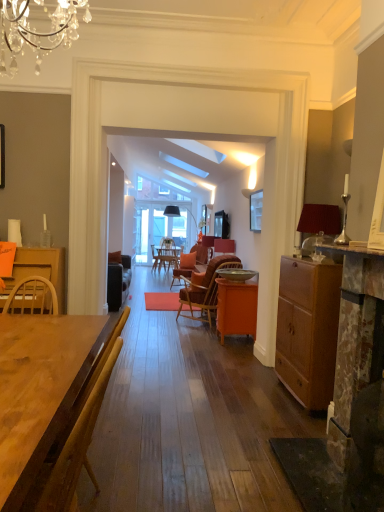
Question: From a real-world perspective, does matte brown cabinet at right stand above orange matte cabinet at center, which ranks as the 2th desk in front-to-back order?

Choices:
 (A) yes
 (B) no

Answer: (A)

Question: Is matte brown cabinet at right to the left of orange matte cabinet at center, which ranks as the 2th desk in front-to-back order, from the viewer's perspective?

Choices:
 (A) yes
 (B) no

Answer: (B)

Question: Considering the relative sizes of matte brown cabinet at right and orange matte cabinet at center, positioned as the 1th desk in right-to-left order, in the image provided, is matte brown cabinet at right thinner than orange matte cabinet at center, positioned as the 1th desk in right-to-left order,?

Choices:
 (A) no
 (B) yes

Answer: (B)

Question: Is matte brown cabinet at right further to camera compared to orange matte cabinet at center, which ranks as the 2th desk in front-to-back order?

Choices:
 (A) no
 (B) yes

Answer: (A)

Question: From a real-world perspective, is matte brown cabinet at right positioned under orange matte cabinet at center, which appears as the first desk when viewed from the back, based on gravity?

Choices:
 (A) yes
 (B) no

Answer: (B)

Question: Can you confirm if matte brown cabinet at right is shorter than orange matte cabinet at center, which appears as the first desk when viewed from the back?

Choices:
 (A) no
 (B) yes

Answer: (A)

Question: Is matte brown cabinet at right oriented towards wooden table at center, positioned as the 1th desk in front-to-back order?

Choices:
 (A) yes
 (B) no

Answer: (B)

Question: Is matte brown cabinet at right to the left of wooden table at center, positioned as the 1th desk in front-to-back order, from the viewer's perspective?

Choices:
 (A) yes
 (B) no

Answer: (B)

Question: Is the position of matte brown cabinet at right less distant than that of wooden table at center, arranged as the 2th desk when viewed from the right?

Choices:
 (A) no
 (B) yes

Answer: (A)

Question: Are matte brown cabinet at right and wooden table at center, arranged as the 2th desk when viewed from the right, making contact?

Choices:
 (A) no
 (B) yes

Answer: (A)

Question: From a real-world perspective, does matte brown cabinet at right stand above wooden table at center, the first desk positioned from the left?

Choices:
 (A) no
 (B) yes

Answer: (A)

Question: Does matte brown cabinet at right have a greater height compared to wooden table at center, the first desk positioned from the left?

Choices:
 (A) no
 (B) yes

Answer: (B)

Question: From the image's perspective, is orange matte cabinet at center, which ranks as the 2th desk in front-to-back order, beneath matte black speaker at center?

Choices:
 (A) yes
 (B) no

Answer: (A)